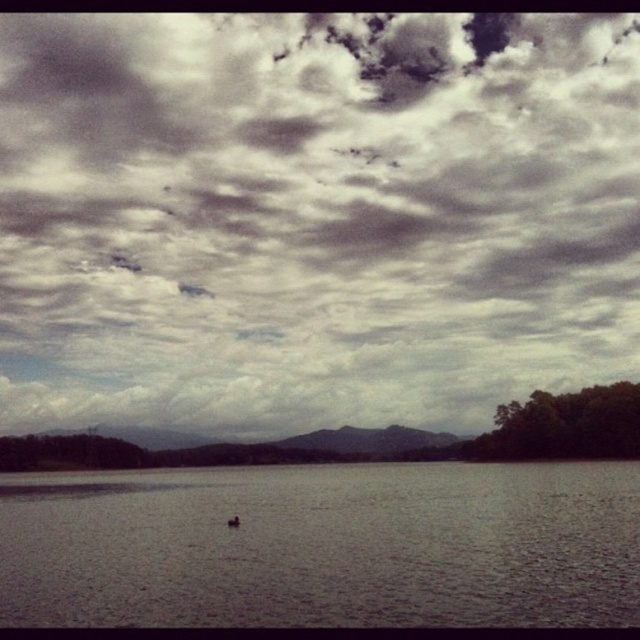
The width and height of the screenshot is (640, 640). Describe the element at coordinates (314, 216) in the screenshot. I see `cloudy sky at upper center` at that location.

Does cloudy sky at upper center come behind gray matte water at center?

Yes, cloudy sky at upper center is behind gray matte water at center.

Who is more forward, (403,22) or (435,483)?

Positioned in front is point (435,483).

Locate an element on the screen. This screenshot has width=640, height=640. cloudy sky at upper center is located at coordinates (314, 216).